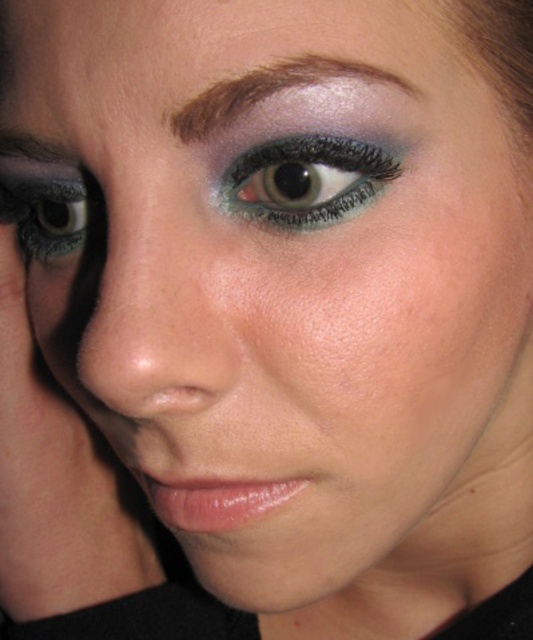
You are a makeup artist analyzing the portrait. You notice the shiny teal eye at center and the shiny brown eyebrow at upper center. Which object is closer to you when observing the face?

The shiny teal eye at center is closer to you than the shiny brown eyebrow at upper center because it is positioned further to the viewer.